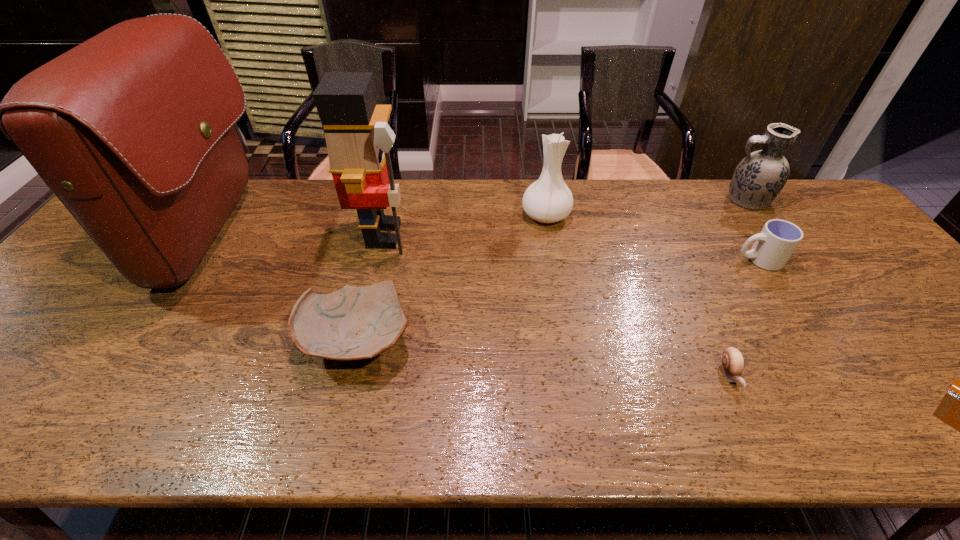
In order to click on free space located in front of the nutcracker holding the staff in this screenshot , I will do `click(549, 235)`.

The height and width of the screenshot is (540, 960). Find the location of `blank space located 0.240m on the left of the fifth object from right to left`. blank space located 0.240m on the left of the fifth object from right to left is located at coordinates (443, 215).

This screenshot has height=540, width=960. I want to click on vacant point located 0.380m with the handle on the side of the right vase, so click(x=601, y=200).

What are the coordinates of `free space located 0.120m with the handle on the side of the right vase` in the screenshot? It's located at (684, 200).

Where is `vacant region located with the handle on the side of the right vase`? This screenshot has height=540, width=960. vacant region located with the handle on the side of the right vase is located at coordinates (645, 200).

The image size is (960, 540). Find the location of `free point located 0.090m with the handle on the side of the cup`. free point located 0.090m with the handle on the side of the cup is located at coordinates (702, 260).

Where is `vacant space located with the handle on the side of the cup`? Image resolution: width=960 pixels, height=540 pixels. vacant space located with the handle on the side of the cup is located at coordinates (592, 260).

You are a GUI agent. You are given a task and a screenshot of the screen. Output one action in this format:
    pyautogui.click(x=<x>, y=<y>)
    Task: Click on the vacant space situated with the handle on the side of the cup
    The image size is (960, 540).
    Given the screenshot: What is the action you would take?
    pyautogui.click(x=698, y=260)

The width and height of the screenshot is (960, 540). Identify the location of vacant point located 0.370m on the right of the pottery. (574, 340).

Where is `satchel at the far edge`? satchel at the far edge is located at coordinates (133, 130).